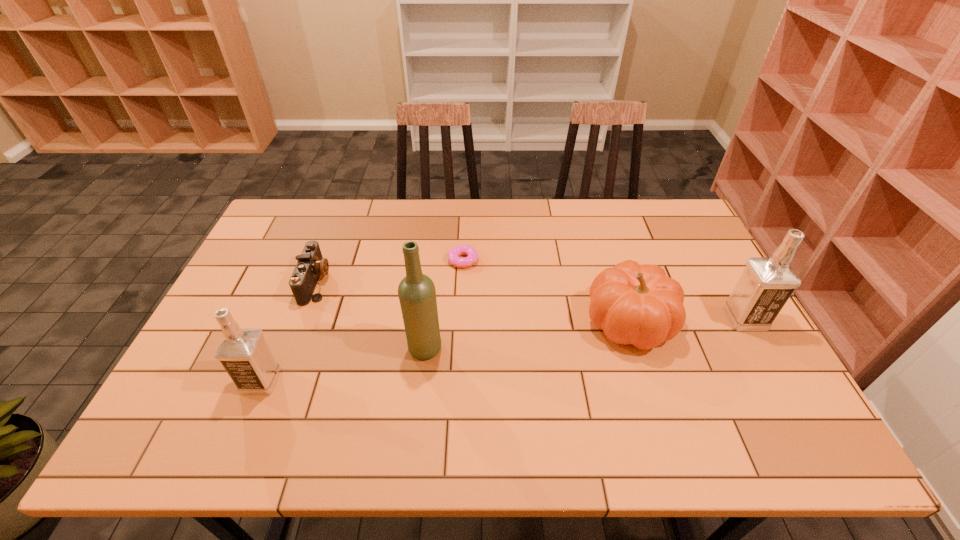
Where is `vacant space located on the right of the shortest object`? The width and height of the screenshot is (960, 540). vacant space located on the right of the shortest object is located at coordinates (519, 260).

Where is `free space located 0.080m on the right of the wine bottle`? This screenshot has width=960, height=540. free space located 0.080m on the right of the wine bottle is located at coordinates (472, 348).

Locate an element on the screen. The width and height of the screenshot is (960, 540). free space located 0.060m on the front-facing side of the fifth tallest object is located at coordinates (349, 282).

Locate an element on the screen. The height and width of the screenshot is (540, 960). free space located on the right of the pumpkin is located at coordinates (726, 322).

The image size is (960, 540). I want to click on object that is positioned at the near edge, so tap(243, 352).

Where is `object positioned at the left edge`? The width and height of the screenshot is (960, 540). object positioned at the left edge is located at coordinates (243, 352).

Image resolution: width=960 pixels, height=540 pixels. What are the coordinates of `object located at the right edge` in the screenshot? It's located at (765, 285).

Identify the location of object that is at the near left corner. (243, 352).

Where is `vacant space at the far edge of the desktop`? vacant space at the far edge of the desktop is located at coordinates (559, 224).

Where is `vacant space at the near edge of the desktop`? vacant space at the near edge of the desktop is located at coordinates (684, 383).